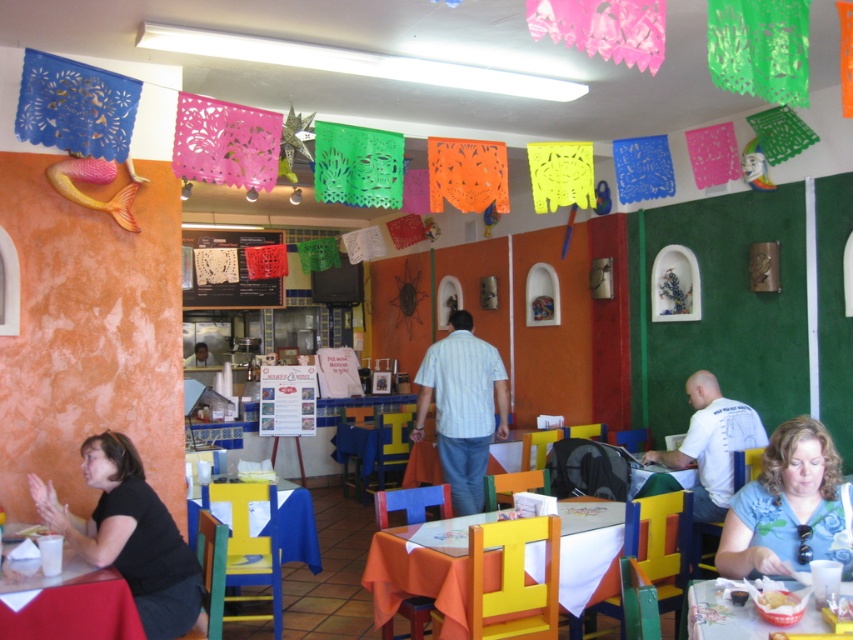
You are a customer sitting at a table in the Mexican themed restaurant. You notice a black fabric shirt at lower left. Where exactly is the black fabric shirt located in relation to your current position?

The black fabric shirt at lower left is located at point 0.839 on the horizontal axis and 0.154 on the vertical axis relative to the image frame.

You are a server in the restaurant and need to place a white cotton shirt at lower right on top of the orange fabric table at center. Will the table be able to support the shirt without it falling off?

The orange fabric table at center is shorter than the white cotton shirt at lower right, so placing the shirt on top might cause it to hang off the edges since the table is not tall enough to fully support it.

You are a customer sitting at the table in the center of the restaurant. You notice a black fabric shirt at lower left and a white lace menu at center. Which object is positioned to the right of the other?

The black fabric shirt at lower left is to the right of the white lace menu at center.